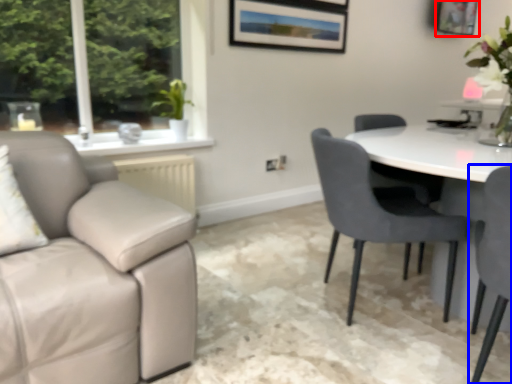
Question: Which object appears farthest to the camera in this image, picture frame (highlighted by a red box) or chair (highlighted by a blue box)?

Choices:
 (A) picture frame
 (B) chair

Answer: (A)